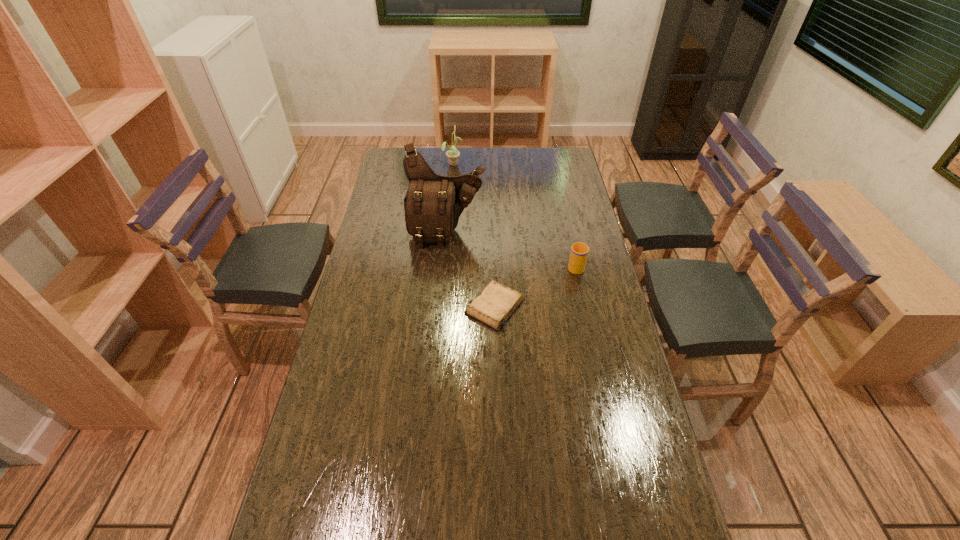
This screenshot has height=540, width=960. Find the location of `vacant space situated 0.100m on the side of the second shortest object with the handle`. vacant space situated 0.100m on the side of the second shortest object with the handle is located at coordinates (570, 241).

At what (x,y) coordinates should I click in order to perform the action: click on free space located on the side of the second shortest object with the handle. Please return your answer as a coordinate pair (x, y). This screenshot has width=960, height=540. Looking at the image, I should click on (566, 226).

The width and height of the screenshot is (960, 540). I want to click on free spot located on the side of the second shortest object with the handle, so click(x=572, y=249).

You are a GUI agent. You are given a task and a screenshot of the screen. Output one action in this format:
    pyautogui.click(x=<x>, y=<y>)
    Task: Click on the vacant space situated 0.400m on the front of the diary
    
    Given the screenshot: What is the action you would take?
    pyautogui.click(x=499, y=458)

Find the location of `object at the far edge`. object at the far edge is located at coordinates (453, 154).

Find the location of `object situated at the left edge`. object situated at the left edge is located at coordinates 433,204.

The height and width of the screenshot is (540, 960). What are the coordinates of `object that is at the right edge` in the screenshot? It's located at (579, 252).

Where is `free region at the left edge of the desktop`? Image resolution: width=960 pixels, height=540 pixels. free region at the left edge of the desktop is located at coordinates (307, 491).

The image size is (960, 540). Find the location of `vacant space at the right edge of the desktop`. vacant space at the right edge of the desktop is located at coordinates (561, 204).

The image size is (960, 540). In the image, there is a desktop. In order to click on blank space at the far left corner in this screenshot , I will do `click(395, 148)`.